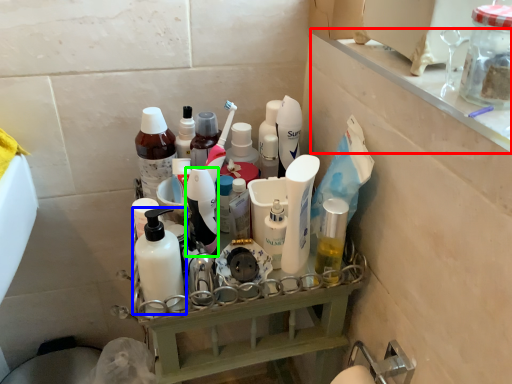
Question: Which object is positioned closest to ledge (highlighted by a red box)? Select from bottle (highlighted by a blue box) and toiletry (highlighted by a green box).

Choices:
 (A) bottle
 (B) toiletry

Answer: (B)